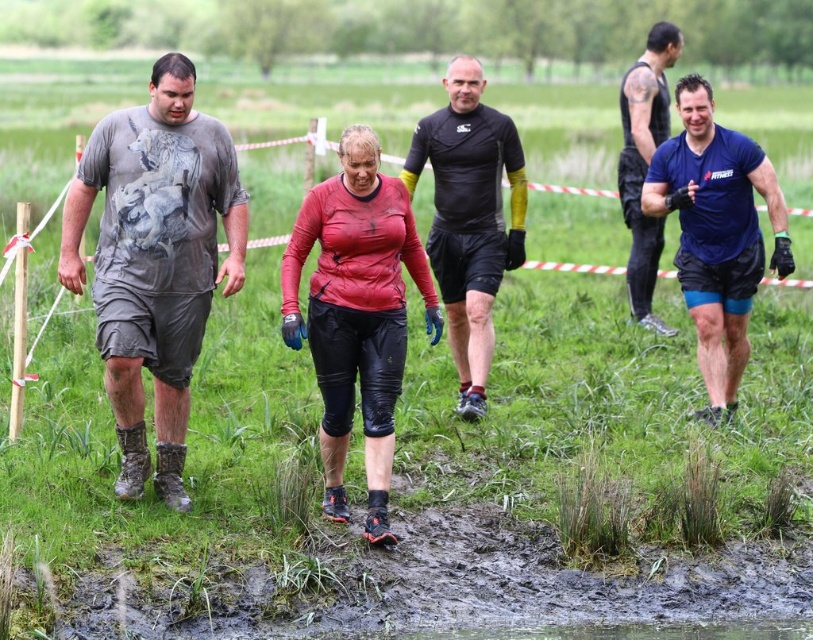
Question: Considering the real-world distances, which object is closest to the black matte shorts at center?

Choices:
 (A) blue matte shirt at right
 (B) dirty gray shorts at left
 (C) red matte leggings at center

Answer: (A)

Question: Is blue matte shirt at right smaller than black matte shorts at center?

Choices:
 (A) no
 (B) yes

Answer: (A)

Question: Is red matte leggings at center to the left of blue matte t-shirt at upper right from the viewer's perspective?

Choices:
 (A) yes
 (B) no

Answer: (A)

Question: Does blue matte shirt at right have a smaller size compared to black matte shorts at center?

Choices:
 (A) yes
 (B) no

Answer: (B)

Question: Which of the following is the closest to the observer?

Choices:
 (A) (172, 506)
 (B) (688, 102)
 (C) (620, 154)

Answer: (A)

Question: Estimate the real-world distances between objects in this image. Which object is closer to the blue matte shirt at right?

Choices:
 (A) blue matte t-shirt at upper right
 (B) black matte shorts at center

Answer: (B)